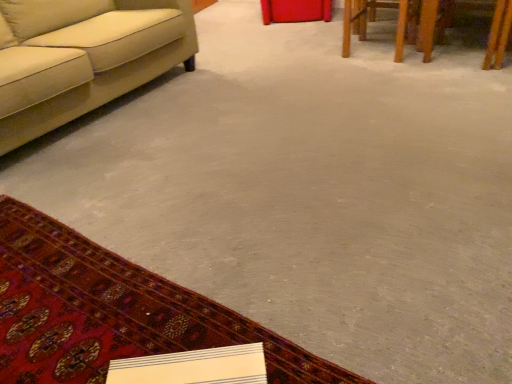
Question: Is carpeted mat at lower left in front of or behind wooden table at upper right in the image?

Choices:
 (A) front
 (B) behind

Answer: (A)

Question: Visually, is carpeted mat at lower left positioned to the left or to the right of wooden table at upper right?

Choices:
 (A) right
 (B) left

Answer: (B)

Question: Which of these objects is positioned farthest from the carpeted mat at lower left?

Choices:
 (A) beige fabric couch at left
 (B) wooden table at upper right

Answer: (B)

Question: Estimate the real-world distances between objects in this image. Which object is closer to the wooden table at upper right?

Choices:
 (A) carpeted mat at lower left
 (B) beige fabric couch at left

Answer: (B)